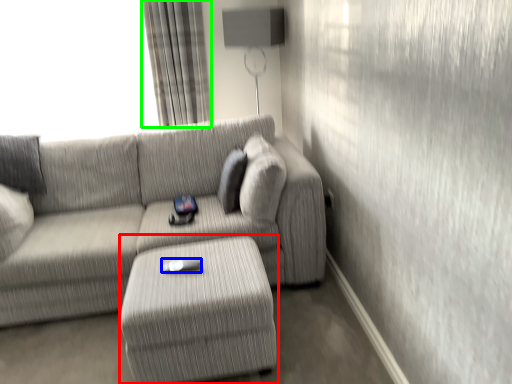
Question: Which object is the closest to the table (highlighted by a red box)? Choose among these: Wii controller (highlighted by a blue box) or curtain (highlighted by a green box).

Choices:
 (A) Wii controller
 (B) curtain

Answer: (A)